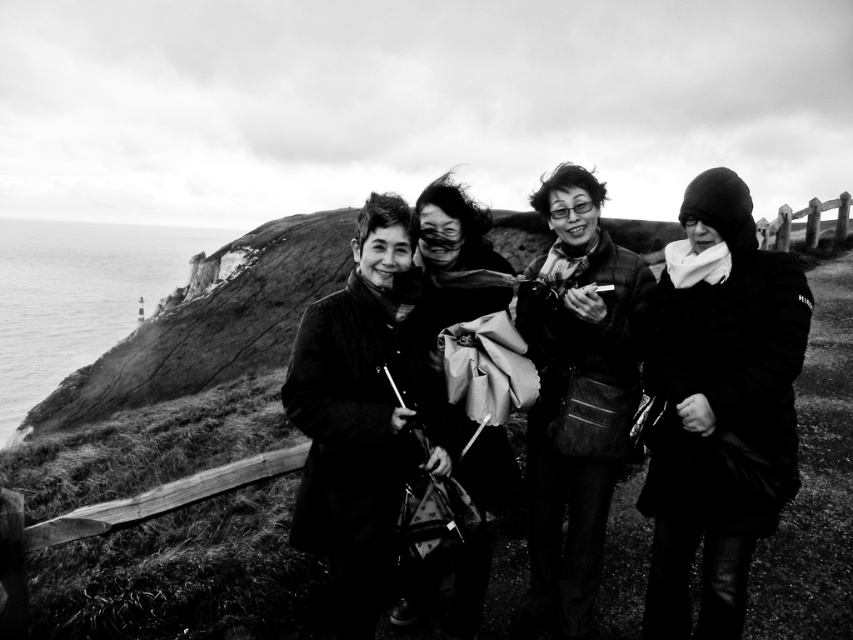
Looking at this image, which object is located at the point with coordinates [718,406]?

The black woolen coat at right is located at the point with coordinates [718,406].

Consider the image. You are standing at the coastal cliff and want to take a photo of both point (694, 356) and point (573, 180). Which point should you focus on first to ensure both are in focus?

You should focus on point (694, 356) first because it is closer to the camera than point (573, 180). This ensures the depth of field will cover both points.

You are standing on the cliff and want to hand a gift to the person wearing the black woolen coat at right. However, there is a matte black scarf at center blocking your path. Can you reach the person without moving the scarf?

The black woolen coat at right is closer to the viewer than the matte black scarf at center, so you can reach the person without moving the scarf because the coat is in front of the scarf.